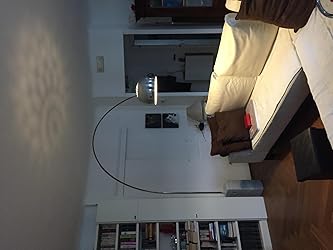
What are the coordinates of `shelving` in the screenshot? It's located at (172, 232).